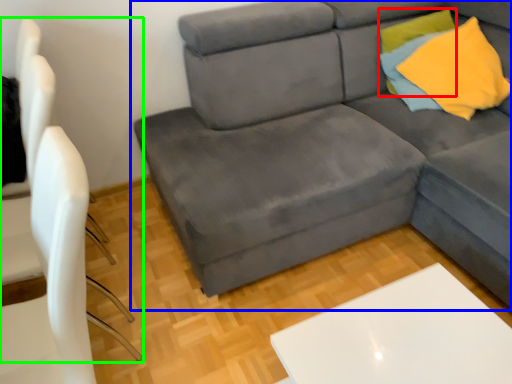
Question: Estimate the real-world distances between objects in this image. Which object is farther from pillow (highlighted by a red box), studio couch (highlighted by a blue box) or armchair (highlighted by a green box)?

Choices:
 (A) studio couch
 (B) armchair

Answer: (B)